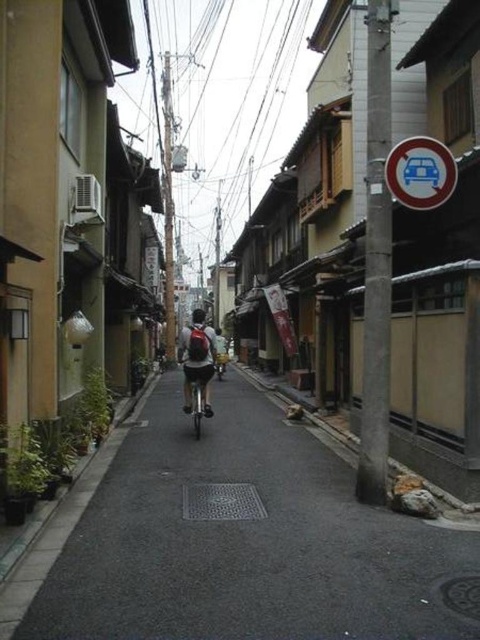
Question: Can you confirm if dark gray asphalt at center is wider than metallic reflective no parking sign at upper right?

Choices:
 (A) yes
 (B) no

Answer: (A)

Question: Can you confirm if dark gray asphalt at center is positioned to the right of matte black backpack at center?

Choices:
 (A) no
 (B) yes

Answer: (B)

Question: Considering the real-world distances, which object is closest to the metallic reflective no parking sign at upper right?

Choices:
 (A) dark gray asphalt at center
 (B) shiny metallic bicycle at center
 (C) metallic silver bicycle at center

Answer: (A)

Question: Can you confirm if metallic reflective no parking sign at upper right is positioned above matte black backpack at center?

Choices:
 (A) no
 (B) yes

Answer: (B)

Question: Estimate the real-world distances between objects in this image. Which object is farther from the metallic reflective no parking sign at upper right?

Choices:
 (A) matte black backpack at center
 (B) shiny metallic bicycle at center
 (C) dark gray asphalt at center

Answer: (A)

Question: Which of these objects is positioned closest to the matte black backpack at center?

Choices:
 (A) metallic silver bicycle at center
 (B) dark gray asphalt at center
 (C) shiny metallic bicycle at center
 (D) metallic reflective no parking sign at upper right

Answer: (A)